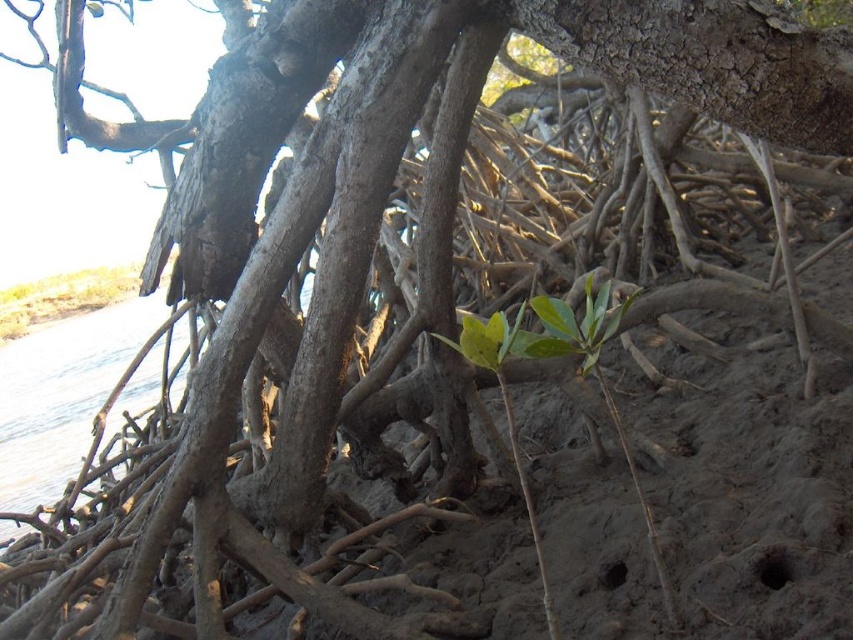
What is the relationship between the size of the clear water at lower left and the green leafy plant at upper left in the image?

The clear water at lower left is larger in size than the green leafy plant at upper left.

You are a researcher studying mangrove root systems. You have two points marked on your map at coordinates point (144, 368) and point (74, 307). If you are standing at the first point, which direction should you move to reach the second point?

Point (144, 368) is in front of point (74, 307), so you should move backward to reach the second point.